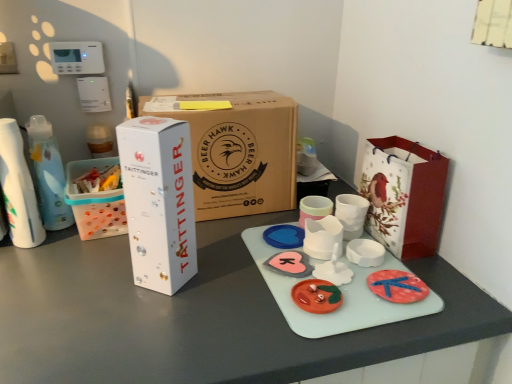
You are a GUI agent. You are given a task and a screenshot of the screen. Output one action in this format:
    pyautogui.click(x=<x>, y=<y>)
    Task: Click on the empty space that is in between blue rubber heart at center, which appears as the fourth toy when viewed from the front, and white glossy box at left, marked as the 1th box in a front-to-back arrangement
    The height and width of the screenshot is (384, 512).
    Given the screenshot: What is the action you would take?
    pyautogui.click(x=227, y=260)